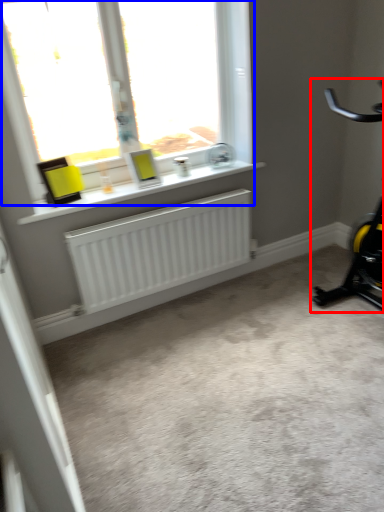
Question: Which point is closer to the camera, stationary bicycle (highlighted by a red box) or window (highlighted by a blue box)?

Choices:
 (A) stationary bicycle
 (B) window

Answer: (A)